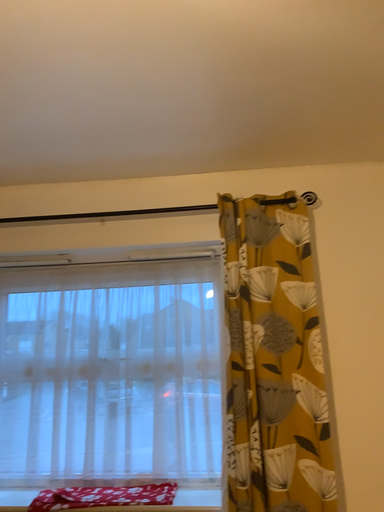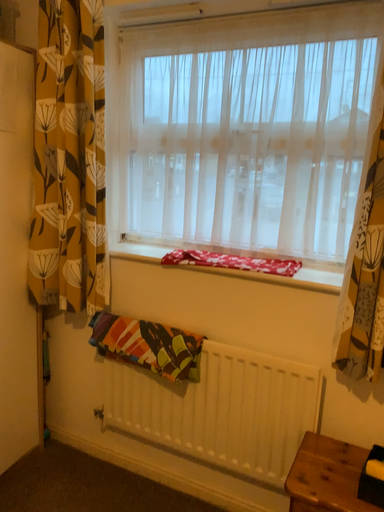
Question: How did the camera likely rotate when shooting the video?

Choices:
 (A) rotated upward
 (B) rotated downward

Answer: (B)